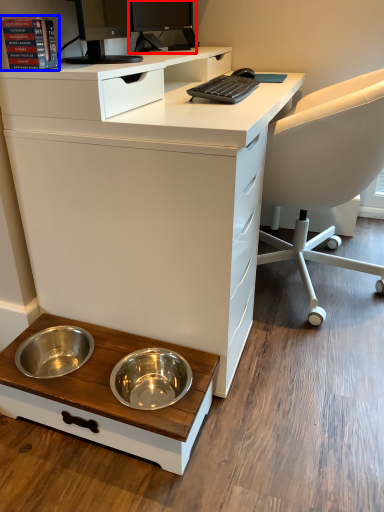
Question: Which object appears closest to the camera in this image, desktop computer (highlighted by a red box) or book (highlighted by a blue box)?

Choices:
 (A) desktop computer
 (B) book

Answer: (B)